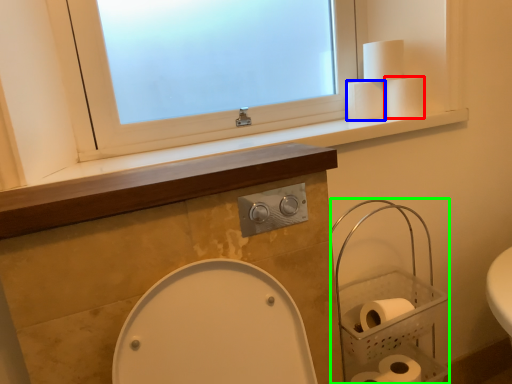
Question: Based on their relative distances, which object is nearer to toilet paper (highlighted by a red box)? Choose from toilet paper (highlighted by a blue box) and basket (highlighted by a green box).

Choices:
 (A) toilet paper
 (B) basket

Answer: (A)